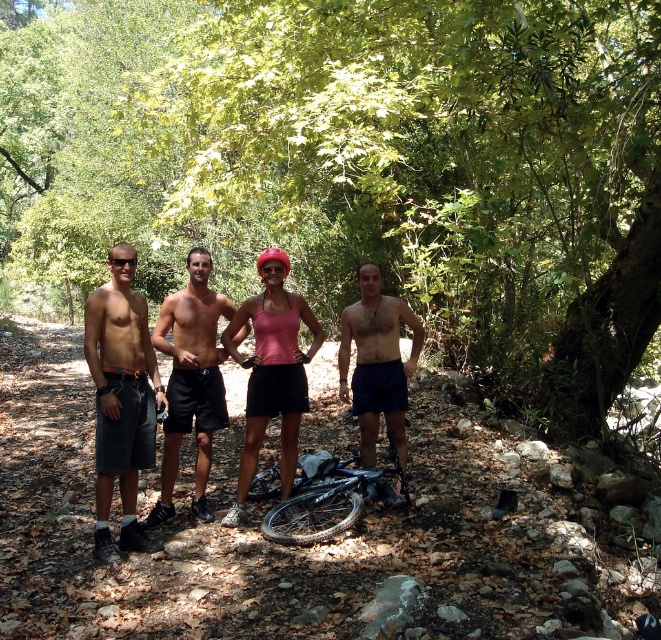
Between gray cotton shorts at left and pink matte tank top at center, which one has more height?

pink matte tank top at center

Who is more distant from viewer, (x=134, y=406) or (x=243, y=508)?

Point (x=243, y=508)

I want to click on gray cotton shorts at left, so click(x=122, y=400).

From the picture: Does green leafy tree at center come in front of pink matte tank top at center?

No, it is behind pink matte tank top at center.

The image size is (661, 640). I want to click on green leafy tree at center, so [360, 163].

Find the location of a particular element. The height and width of the screenshot is (640, 661). green leafy tree at center is located at coordinates (360, 163).

Does pink matte tank top at center have a greater width compared to blue matte bicycle at center?

No.

The height and width of the screenshot is (640, 661). What do you see at coordinates (270, 372) in the screenshot?
I see `pink matte tank top at center` at bounding box center [270, 372].

Does point (260, 253) come in front of point (266, 477)?

No, it is behind (266, 477).

Identify the location of pink matte tank top at center. (270, 372).